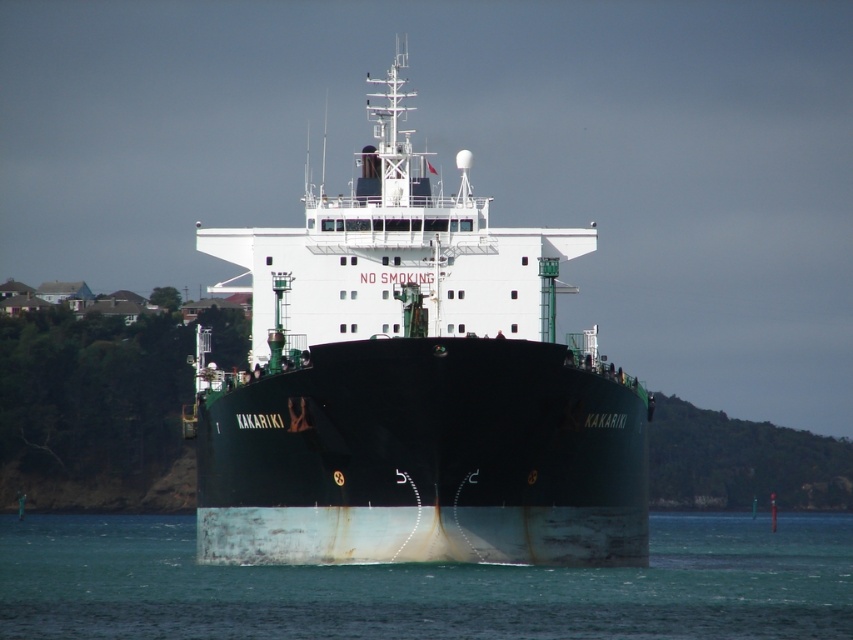
You are a crane operator trying to load containers onto the green matte ship at center. The containers are placed on the smooth teal water at center. Can you safely lift the containers from the water and place them onto the ship?

The green matte ship at center is taller than the smooth teal water at center, so yes, you can safely lift the containers from the smooth teal water at center and place them onto the green matte ship at center since the ship is higher in elevation.

You are a photographer trying to capture the green matte ship at center and the smooth teal water at center in a single shot. Given that the ship is larger than the water in the image, how should you adjust your camera angle to ensure both are fully visible?

The green matte ship at center is larger than the smooth teal water at center. To capture both fully, position the camera closer to the ship to include its full structure while ensuring the water area remains in frame.

You are a maritime inspector evaluating the cargo ship KAKARIKI. You notice the green matte ship at center and the smooth teal water at center. Which object is narrower in terms of width?

The green matte ship at center has a lesser width compared to the smooth teal water at center, so the green matte ship at center is narrower.